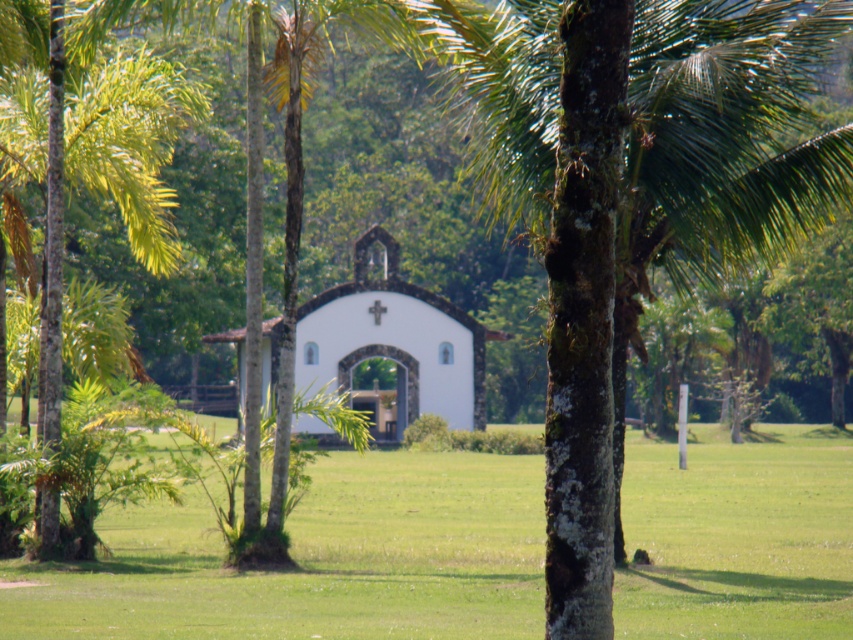
From the picture: You are planning to host an outdoor event and need to know which area is bigger for setting up tables and chairs. Based on the scene, which object between the green grass at center and the white matte church at center is larger in size?

The green grass at center has a larger size compared to the white matte church at center, so it is the better option for setting up tables and chairs.

In the scene shown: You are planning to place a small statue in the scene. The statue requires a flat surface to stand on. Based on the image, which object between the green grass at center and the white matte church at center would be suitable for placing the statue?

The green grass at center is positioned under the white matte church at center, so the statue can be placed on the green grass at center since it is a flat surface.

You are standing at the point marked by coordinates point (316,561) in the image. Based on the scene description, what is the terrain like at this location?

The point (316,561) corresponds to green grass at center, so the terrain at this location is covered in vibrant green grass.